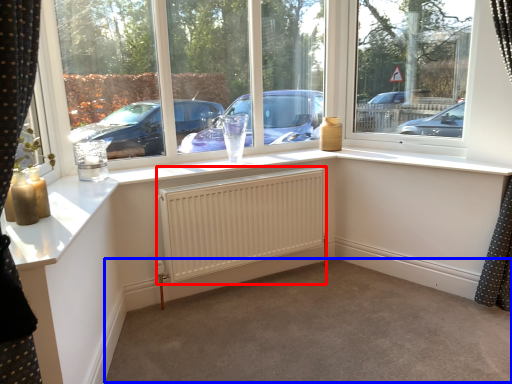
Question: Which object appears farthest to the camera in this image, radiator (highlighted by a red box) or plain (highlighted by a blue box)?

Choices:
 (A) radiator
 (B) plain

Answer: (A)